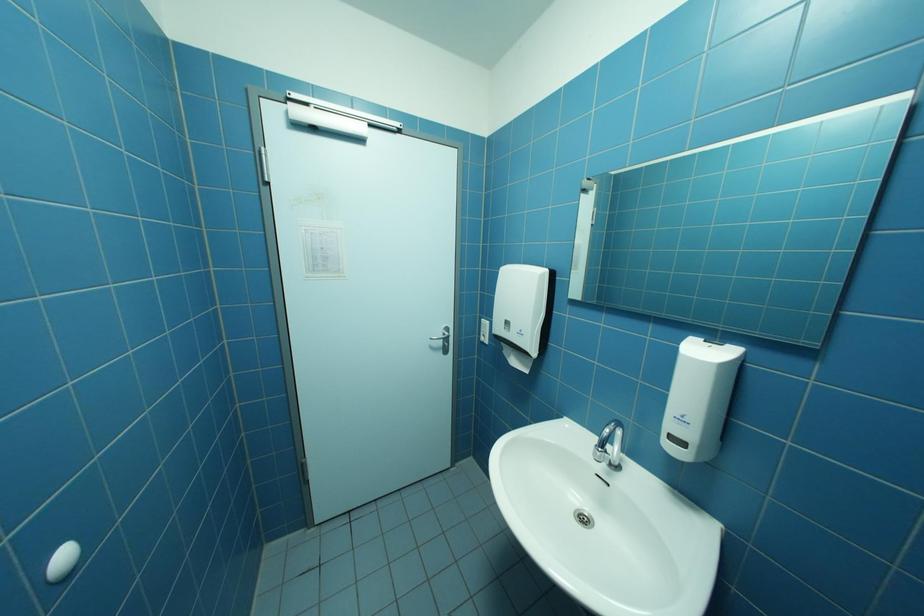
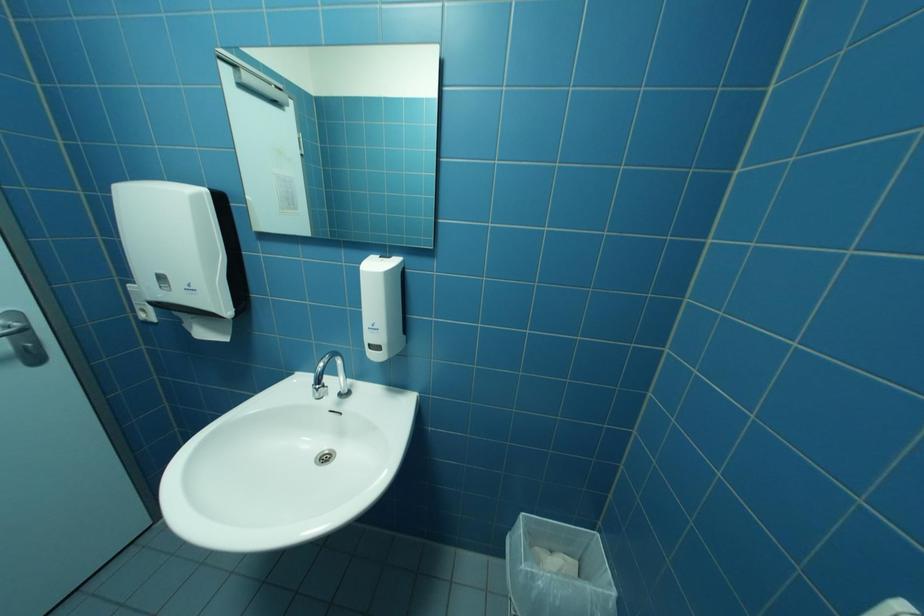
Question: The first image is from the beginning of the video and the second image is from the end. How did the camera likely rotate when shooting the video?

Choices:
 (A) Left
 (B) Right
 (C) Up
 (D) Down

Answer: (B)